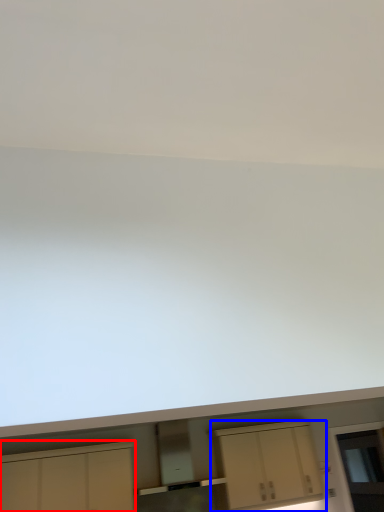
Question: Among these objects, which one is farthest to the camera, cabinetry (highlighted by a red box) or cabinetry (highlighted by a blue box)?

Choices:
 (A) cabinetry
 (B) cabinetry

Answer: (B)